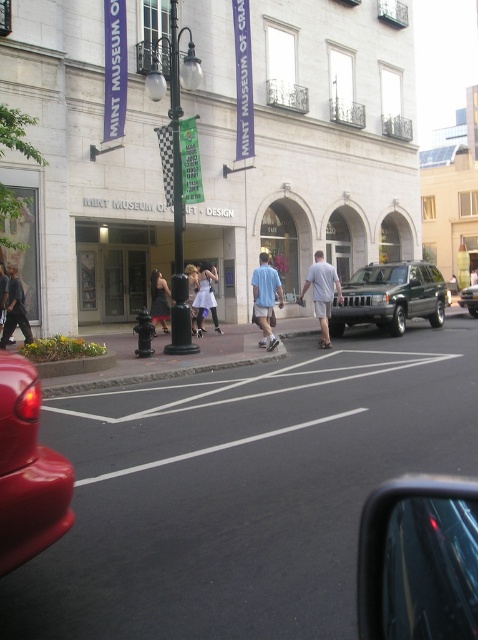
Is light blue cotton shirt at center taller than green matte suv at center?

Yes.

Can you confirm if light blue cotton shirt at center is positioned to the left of green matte suv at center?

Correct, you'll find light blue cotton shirt at center to the left of green matte suv at center.

Does point (313, 262) come farther from viewer compared to point (477, 301)?

Yes, it is behind point (477, 301).

This screenshot has height=640, width=478. I want to click on light blue cotton shirt at center, so 322,292.

Is green matte suv at center-right to the left of light blue cotton shirt at center from the viewer's perspective?

No, green matte suv at center-right is not to the left of light blue cotton shirt at center.

Between green matte suv at center-right and light blue cotton shirt at center, which one appears on the right side from the viewer's perspective?

green matte suv at center-right

Does point (386, 266) lie behind point (316, 305)?

Yes, point (386, 266) is behind point (316, 305).

Locate an element on the screen. The image size is (478, 640). green matte suv at center-right is located at coordinates (391, 298).

Which is behind, point (368, 500) or point (14, 420)?

The point (368, 500) is more distant.

Which is in front, point (365, 586) or point (25, 509)?

Point (365, 586)

The width and height of the screenshot is (478, 640). In order to click on shiny black car at lower right in this screenshot , I will do `click(419, 560)`.

At what (x,y) coordinates should I click in order to perform the action: click on shiny black car at lower right. Please return your answer as a coordinate pair (x, y). Looking at the image, I should click on (419, 560).